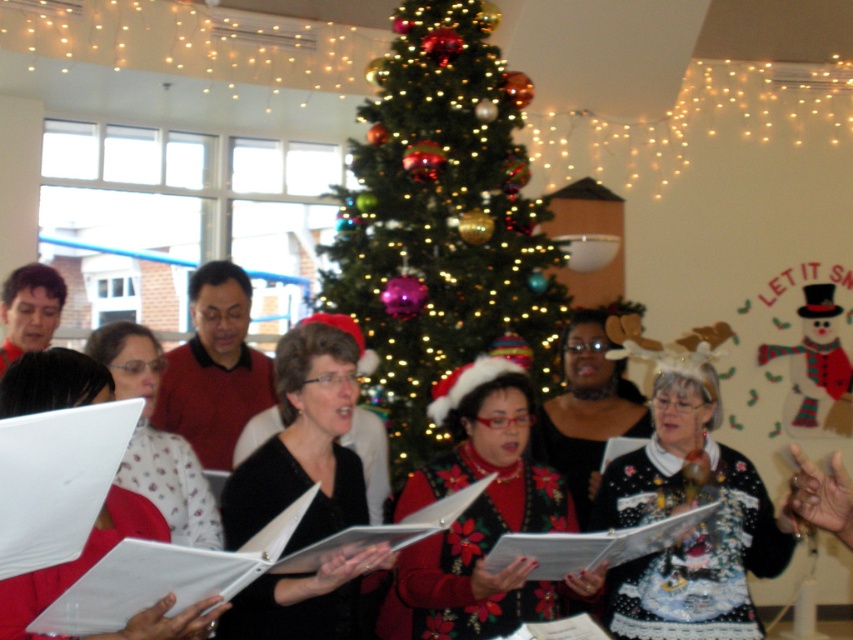
Question: Is velvet red sweater at center positioned at the back of black matte sweater at center?

Choices:
 (A) yes
 (B) no

Answer: (A)

Question: Which point is closer to the camera?

Choices:
 (A) coord(553,403)
 (B) coord(432,628)
 (C) coord(312,513)

Answer: (C)

Question: Which point appears closest to the camera in this image?

Choices:
 (A) (505, 448)
 (B) (303, 525)
 (C) (125, 464)

Answer: (B)

Question: Is shiny green christmas tree at center bigger than white printed paper at center?

Choices:
 (A) no
 (B) yes

Answer: (B)

Question: Which point is farther to the camera?

Choices:
 (A) (430, 500)
 (B) (187, 458)

Answer: (B)

Question: Observing the image, what is the correct spatial positioning of velvet red sweater at center in reference to black sweater at center?

Choices:
 (A) right
 (B) left

Answer: (B)